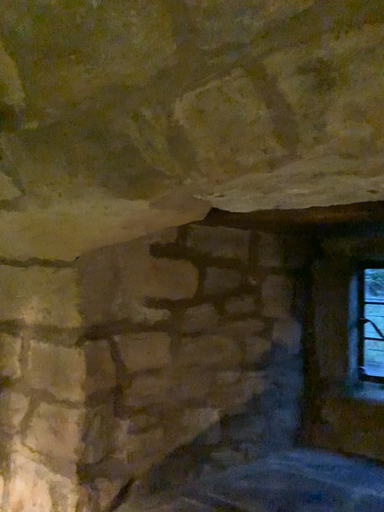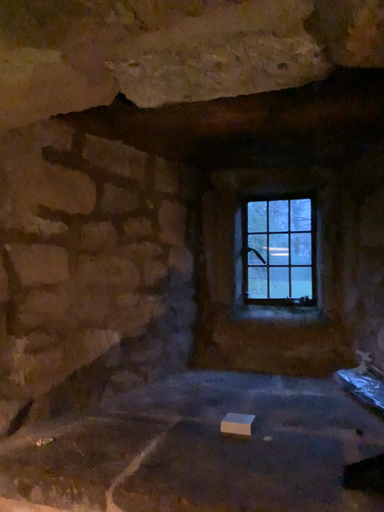
Question: How did the camera likely rotate when shooting the video?

Choices:
 (A) rotated left
 (B) rotated right

Answer: (B)